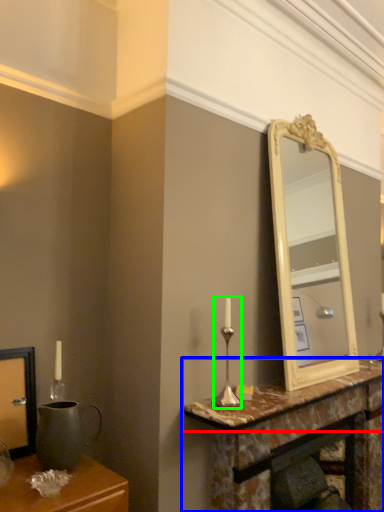
Question: Considering the real-world distances, which object is farthest from counter top (highlighted by a red box)? table (highlighted by a blue box) or candle holder (highlighted by a green box)?

Choices:
 (A) table
 (B) candle holder

Answer: (B)